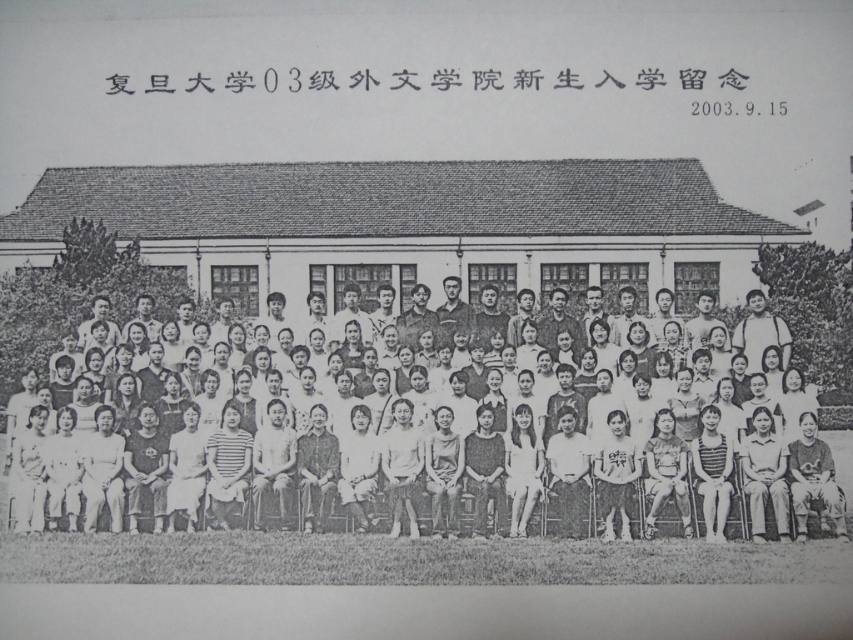
Question: Does black paper at upper center lie behind white cotton shirt at center?

Choices:
 (A) yes
 (B) no

Answer: (A)

Question: Which of the following is the farthest from the observer?

Choices:
 (A) black paper at upper center
 (B) white cotton shirt at center

Answer: (A)

Question: In this image, where is black paper at upper center located relative to white cotton shirt at center?

Choices:
 (A) right
 (B) left

Answer: (A)

Question: Is black paper at upper center bigger than white cotton shirt at center?

Choices:
 (A) no
 (B) yes

Answer: (A)

Question: Which of the following is the farthest from the observer?

Choices:
 (A) (485, 68)
 (B) (637, 385)

Answer: (A)